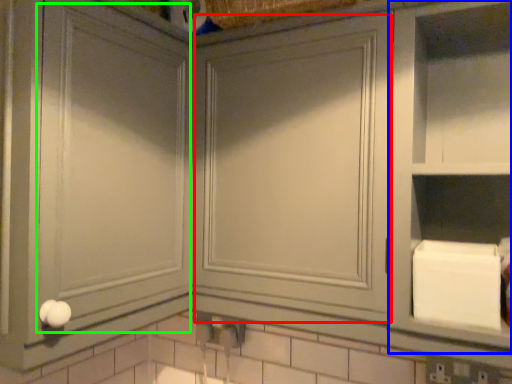
Question: Which is farther away from glass door (highlighted by a red box)? cabinet (highlighted by a blue box) or glass door (highlighted by a green box)?

Choices:
 (A) cabinet
 (B) glass door

Answer: (B)